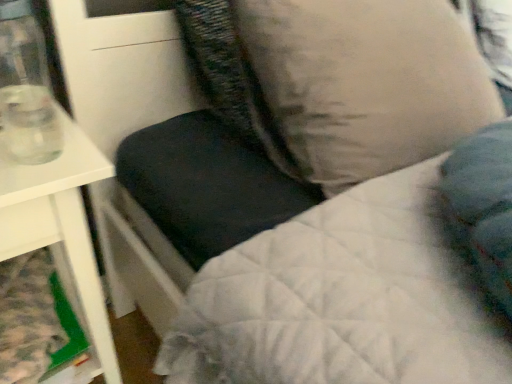
Question: Is beige fabric pillow at upper right taller than white glossy table at left?

Choices:
 (A) yes
 (B) no

Answer: (B)

Question: Is beige fabric pillow at upper right oriented away from white glossy table at left?

Choices:
 (A) no
 (B) yes

Answer: (A)

Question: Can you confirm if beige fabric pillow at upper right is positioned to the right of white glossy table at left?

Choices:
 (A) yes
 (B) no

Answer: (A)

Question: Is white glossy table at left a part of beige fabric pillow at upper right?

Choices:
 (A) no
 (B) yes

Answer: (A)

Question: From the image's perspective, is beige fabric pillow at upper right over white glossy table at left?

Choices:
 (A) yes
 (B) no

Answer: (A)

Question: In the image, is beige fabric pillow at upper right on the left side or the right side of transparent glass at left?

Choices:
 (A) right
 (B) left

Answer: (A)

Question: From a real-world perspective, is beige fabric pillow at upper right above or below transparent glass at left?

Choices:
 (A) below
 (B) above

Answer: (A)

Question: Looking at the image, does beige fabric pillow at upper right seem bigger or smaller compared to transparent glass at left?

Choices:
 (A) small
 (B) big

Answer: (B)

Question: Is point (276, 145) positioned closer to the camera than point (24, 142)?

Choices:
 (A) farther
 (B) closer

Answer: (A)

Question: From their relative heights in the image, would you say white glossy table at left is taller or shorter than beige fabric pillow at upper right?

Choices:
 (A) tall
 (B) short

Answer: (A)

Question: Is white glossy table at left inside or outside of beige fabric pillow at upper right?

Choices:
 (A) inside
 (B) outside

Answer: (B)

Question: Looking at the image, does white glossy table at left seem bigger or smaller compared to beige fabric pillow at upper right?

Choices:
 (A) big
 (B) small

Answer: (A)

Question: Is point (5, 220) closer or farther from the camera than point (364, 4)?

Choices:
 (A) closer
 (B) farther

Answer: (A)

Question: Is point (333, 170) positioned closer to the camera than point (100, 309)?

Choices:
 (A) farther
 (B) closer

Answer: (B)

Question: Is beige fabric pillow at upper right spatially inside white glossy table at left, or outside of it?

Choices:
 (A) inside
 (B) outside

Answer: (B)